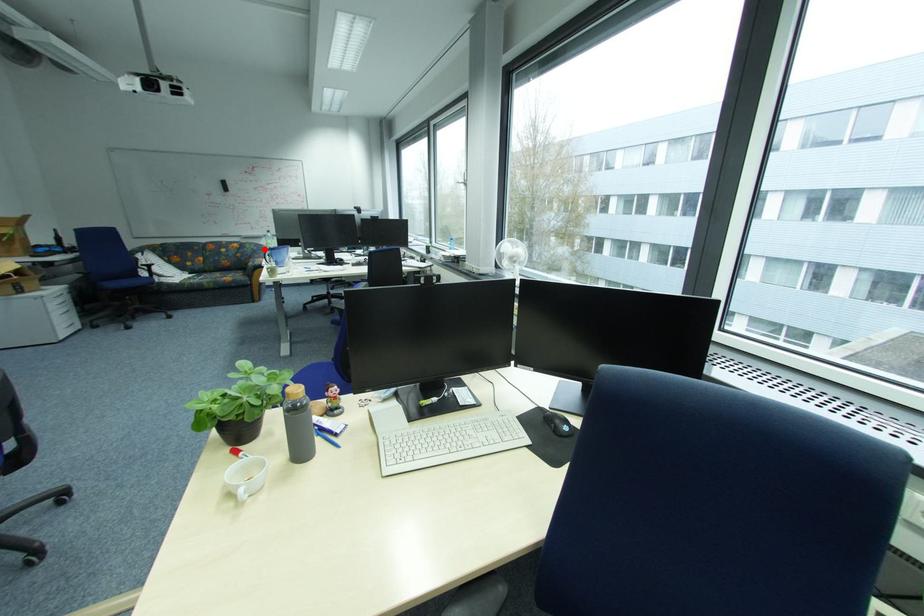
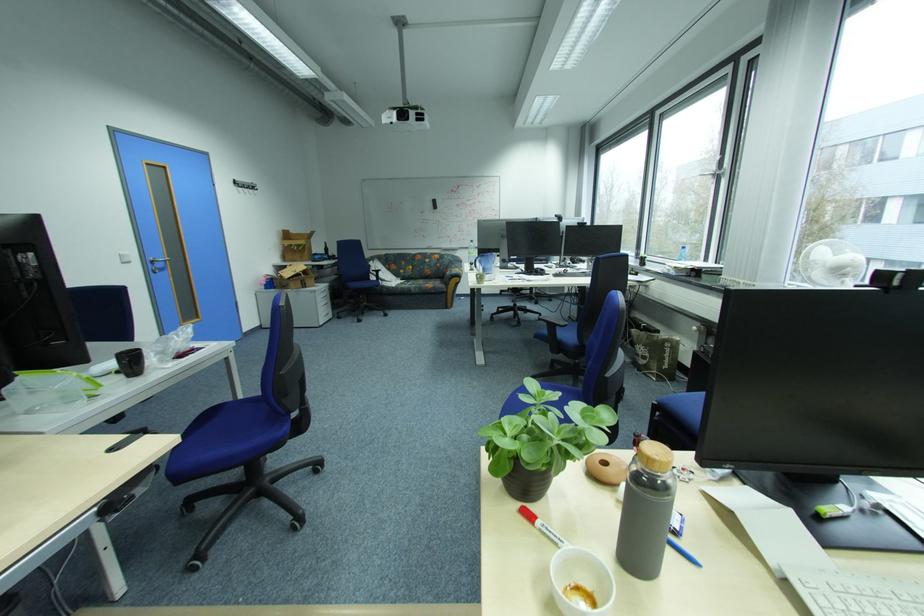
In the second image, find the point that corresponds to the highlighted location in the first image.

(460, 261)